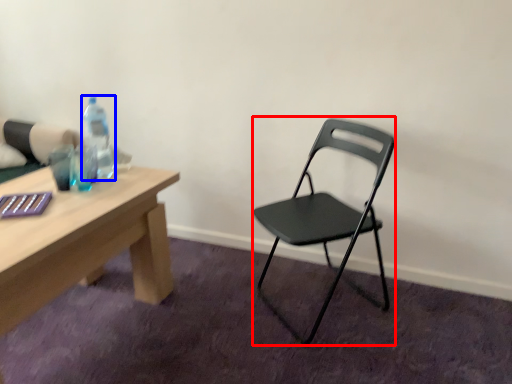
Question: Among these objects, which one is farthest to the camera, chair (highlighted by a red box) or bottle (highlighted by a blue box)?

Choices:
 (A) chair
 (B) bottle

Answer: (B)